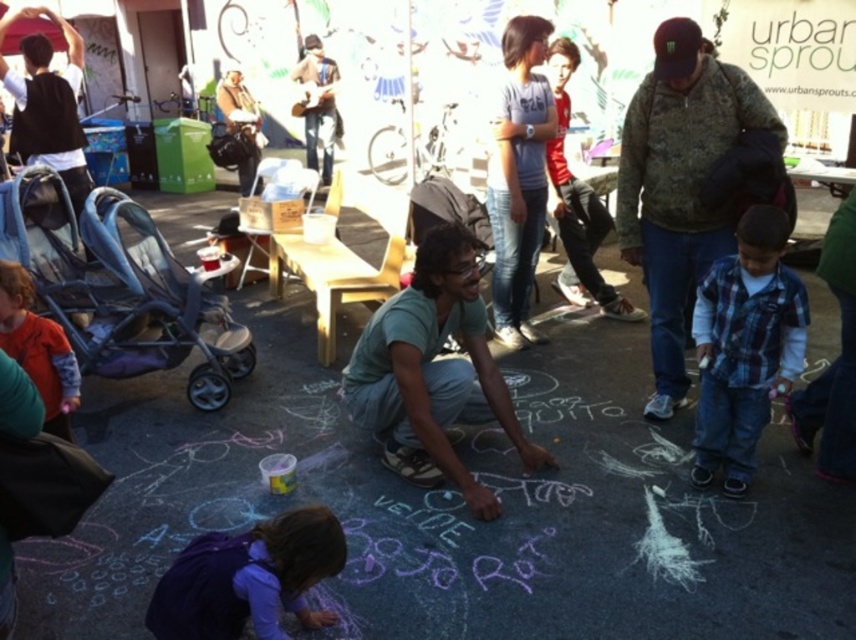
Question: Is camouflage jacket at upper right smaller than green matte shirt at center?

Choices:
 (A) yes
 (B) no

Answer: (B)

Question: Which of the following is the farthest from the observer?

Choices:
 (A) plaid flannel shirt at center
 (B) orange fleece jacket at left
 (C) camouflage jacket at upper right

Answer: (A)

Question: Can you confirm if purple chalk at center is positioned below orange fleece jacket at left?

Choices:
 (A) yes
 (B) no

Answer: (A)

Question: Which object is closer to the camera taking this photo?

Choices:
 (A) camouflage jacket at upper right
 (B) purple chalk at center

Answer: (B)

Question: Is plaid flannel shirt at center bigger than orange fleece jacket at left?

Choices:
 (A) no
 (B) yes

Answer: (B)

Question: Estimate the real-world distances between objects in this image. Which object is closer to the green matte shirt at center?

Choices:
 (A) orange fleece jacket at left
 (B) plaid flannel shirt at lower right
 (C) plaid flannel shirt at center

Answer: (B)